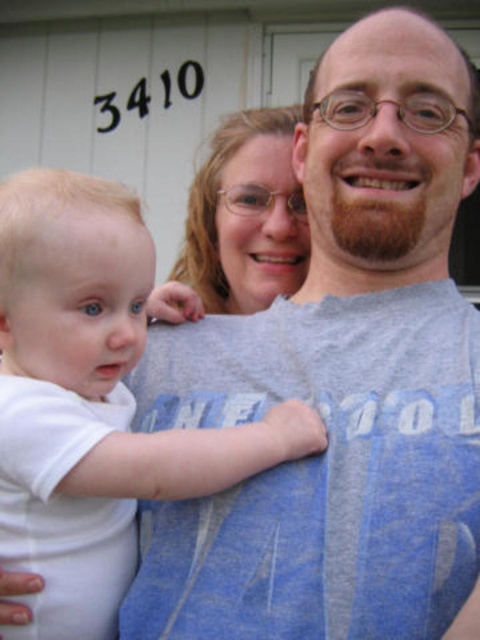
You are a photographer trying to capture a clear shot of the white soft baby at center and the matte gray hair at center. Which object is positioned closer to the camera?

The white soft baby at center is closer to the viewer than the matte gray hair at center, so the baby will appear clearer in the photo.